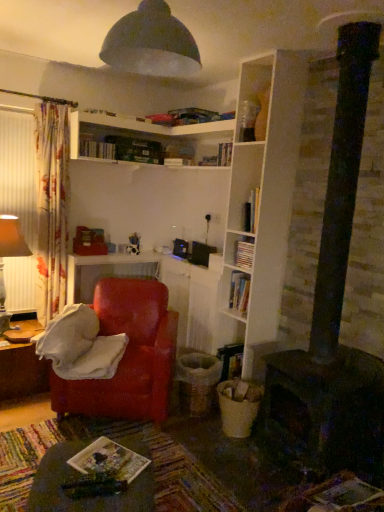
Question: Which is correct: wooden board game at lower center, placed as the first book when sorted from front to back, is inside black matte fireplace at lower right, or outside of it?

Choices:
 (A) outside
 (B) inside

Answer: (A)

Question: Is point (135, 455) closer or farther from the camera than point (311, 424)?

Choices:
 (A) closer
 (B) farther

Answer: (A)

Question: Which is nearer to the wooden table at lower left, which ranks as the second table in front-to-back order?

Choices:
 (A) wooden board game at lower center, positioned as the 2th book in right-to-left order
 (B) matte brown table lamp at left
 (C) matte black lampshade at upper center
 (D) black matte fireplace at lower right
 (E) white matte bookshelf at center, which ranks as the second book in front-to-back order

Answer: (B)

Question: Which object is the closest to the white matte bookshelf at center, the 2th book viewed from the top?

Choices:
 (A) matte red armchair at left
 (B) wooden table at lower left, which ranks as the second table in front-to-back order
 (C) matte black lampshade at upper center
 (D) hardcover book at upper center, which is the 1th book from top to bottom
 (E) white wooden shelves at upper center

Answer: (A)